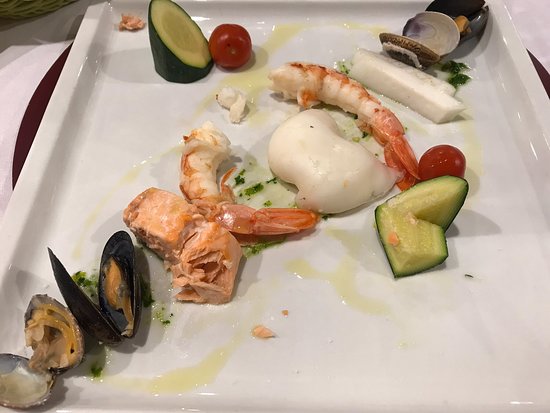
The width and height of the screenshot is (550, 413). I want to click on plate, so click(x=310, y=307).